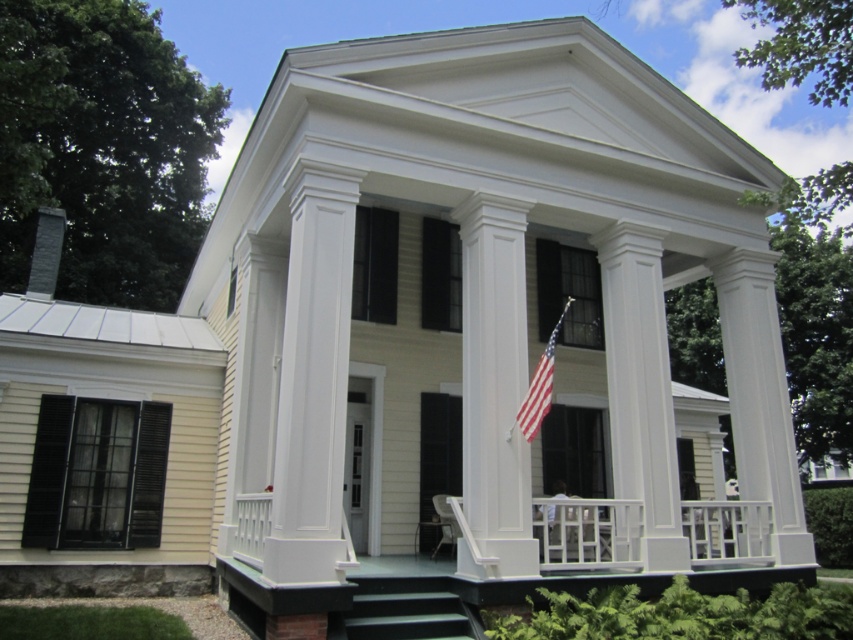
Question: Which object appears farthest from the camera in this image?

Choices:
 (A) white glossy column at center
 (B) american flag at center

Answer: (B)

Question: Can you confirm if white glossy column at center is thinner than dark green concrete stairs at lower center?

Choices:
 (A) no
 (B) yes

Answer: (B)

Question: Which point is closer to the camera?

Choices:
 (A) white glossy column at center
 (B) american flag at center

Answer: (A)

Question: Does white glossy column at center appear under dark green concrete stairs at lower center?

Choices:
 (A) yes
 (B) no

Answer: (B)

Question: Which point is farther from the camera taking this photo?

Choices:
 (A) (364, 609)
 (B) (537, 364)
 (C) (457, 557)

Answer: (B)

Question: Can you confirm if white glossy column at center is positioned above dark green concrete stairs at lower center?

Choices:
 (A) no
 (B) yes

Answer: (B)